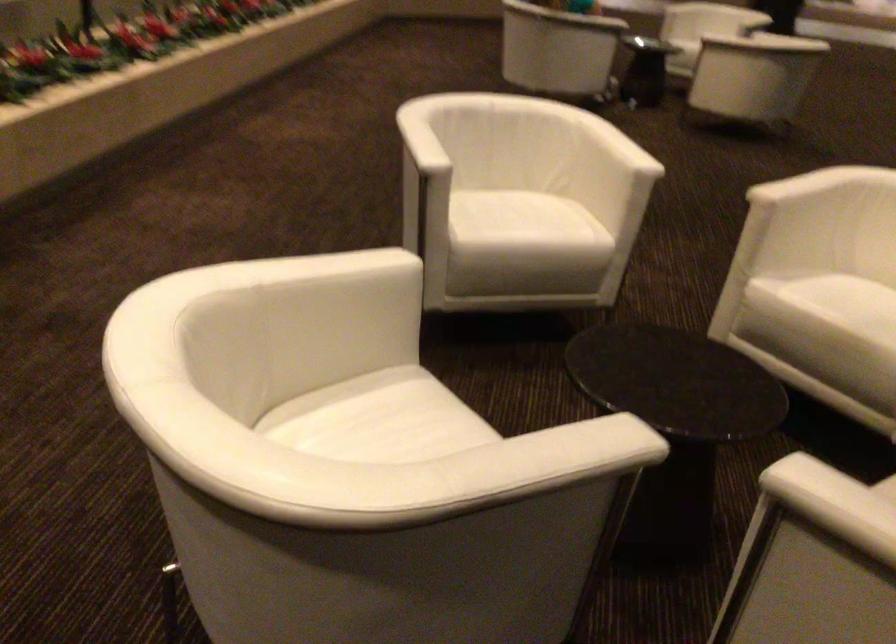
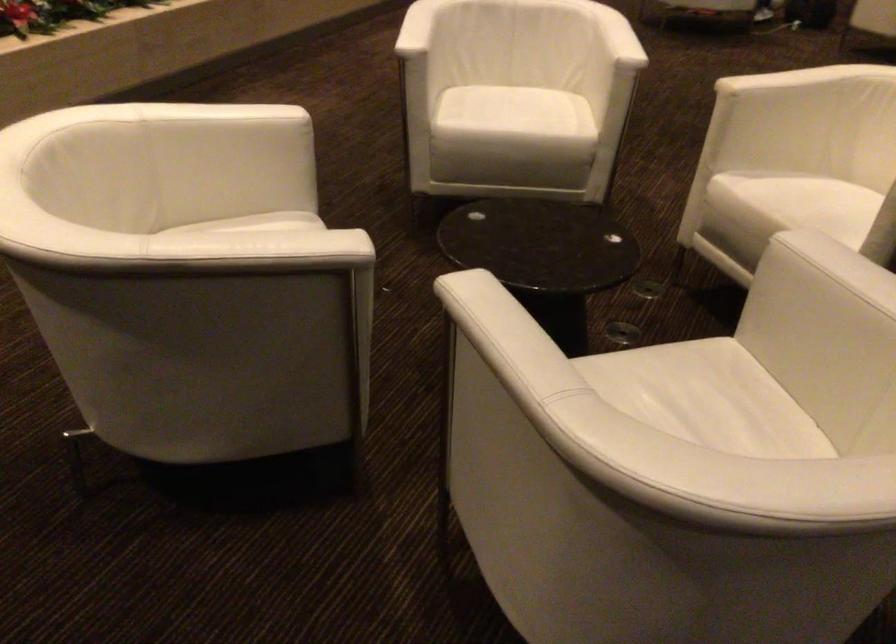
Locate, in the second image, the point that corresponds to (x=427, y=140) in the first image.

(417, 28)